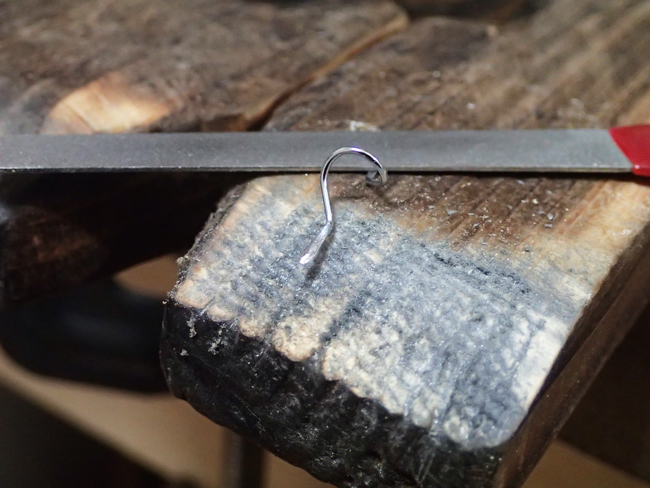
The image size is (650, 488). I want to click on wooden board, so click(420, 116), click(158, 30).